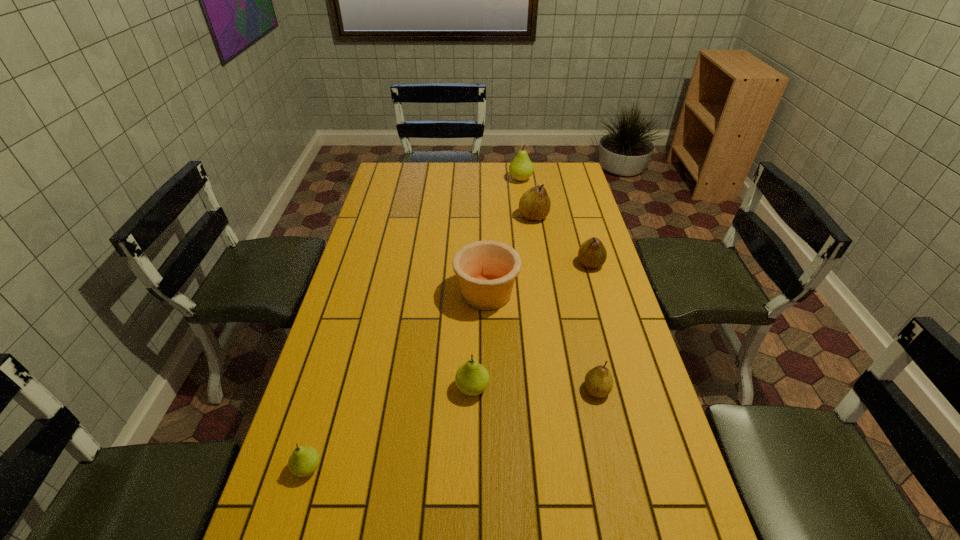
Identify the location of the farthest object. (521, 168).

This screenshot has width=960, height=540. Identify the location of the farthest green pear. (521, 168).

Locate an element on the screen. Image resolution: width=960 pixels, height=540 pixels. the second farthest object is located at coordinates pyautogui.click(x=534, y=204).

Where is `the farthest brown pear`? The height and width of the screenshot is (540, 960). the farthest brown pear is located at coordinates (534, 204).

Identify the location of pottery. This screenshot has height=540, width=960. (486, 270).

Locate an element on the screen. This screenshot has width=960, height=540. the second biggest brown pear is located at coordinates (592, 253).

Identify the location of the third farthest pear. (592, 253).

Locate an element on the screen. Image resolution: width=960 pixels, height=540 pixels. the second green pear from left to right is located at coordinates (472, 378).

You are a GUI agent. You are given a task and a screenshot of the screen. Output one action in this format:
    pyautogui.click(x=<x>, y=<y>)
    Task: Click on the second pear from left to right
    Image resolution: width=960 pixels, height=540 pixels.
    Given the screenshot: What is the action you would take?
    pyautogui.click(x=472, y=378)

The width and height of the screenshot is (960, 540). What are the coordinates of `the nearest green pear` in the screenshot? It's located at (304, 460).